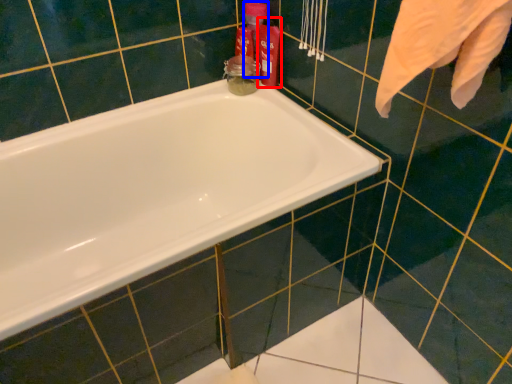
Question: Among these objects, which one is farthest to the camera, cleaning product (highlighted by a red box) or cleaning product (highlighted by a blue box)?

Choices:
 (A) cleaning product
 (B) cleaning product

Answer: (B)